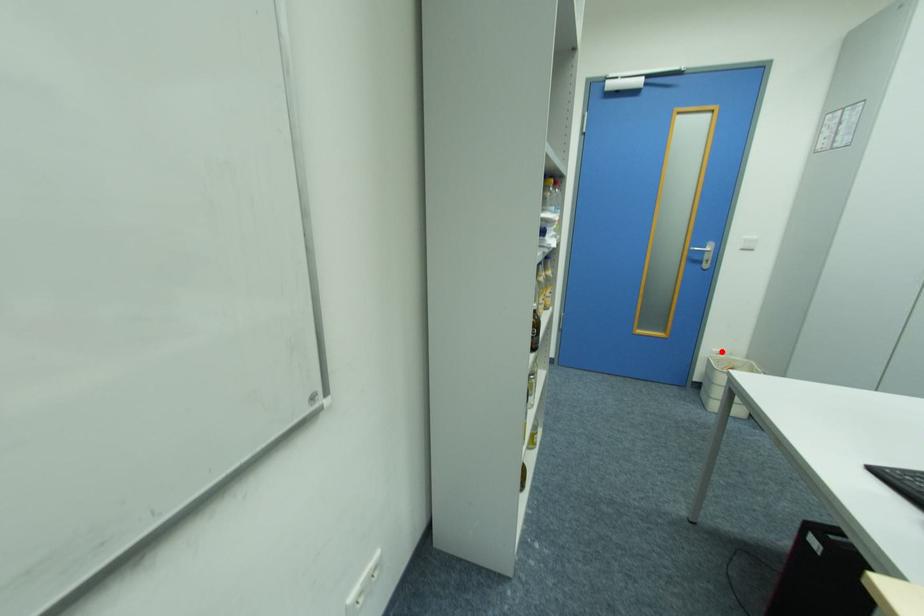
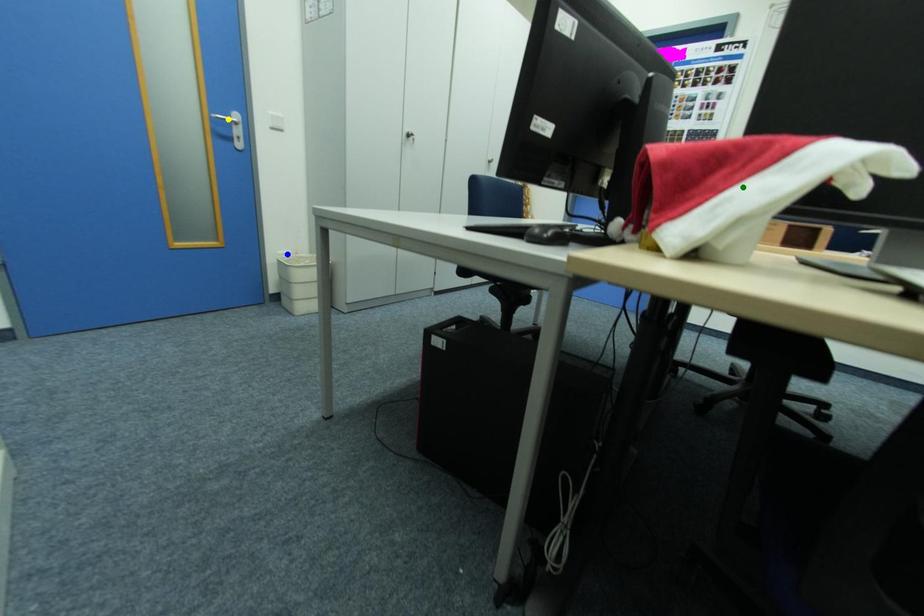
Question: I am providing you with two images of the same scene from different viewpoints. A red point is marked on the first image. You are given multiple points on the second image. In image 2, which mark is for the same physical point as the one in image 1?

Choices:
 (A) yellow point
 (B) blue point
 (C) green point

Answer: (B)